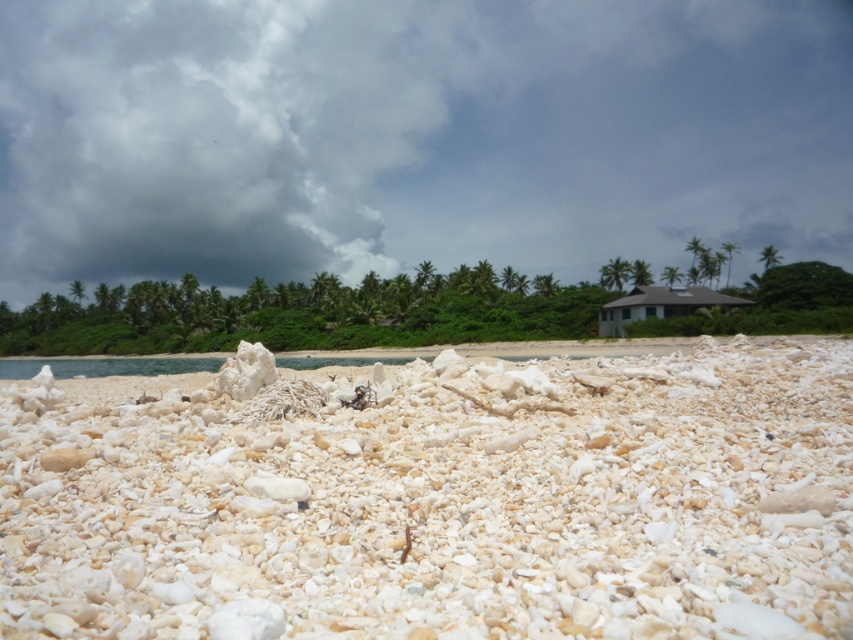
Question: Does cloudy sky at upper center come in front of white gravel at center?

Choices:
 (A) no
 (B) yes

Answer: (A)

Question: Which of the following is the farthest from the observer?

Choices:
 (A) white gravel at center
 (B) cloudy sky at upper center

Answer: (B)

Question: Does cloudy sky at upper center appear on the left side of white gravel at center?

Choices:
 (A) no
 (B) yes

Answer: (B)

Question: Where is cloudy sky at upper center located in relation to white gravel at center in the image?

Choices:
 (A) below
 (B) above

Answer: (B)

Question: Which of the following is the farthest from the observer?

Choices:
 (A) (563, 541)
 (B) (370, 144)

Answer: (B)

Question: Among these points, which one is nearest to the camera?

Choices:
 (A) (548, 237)
 (B) (805, 454)

Answer: (B)